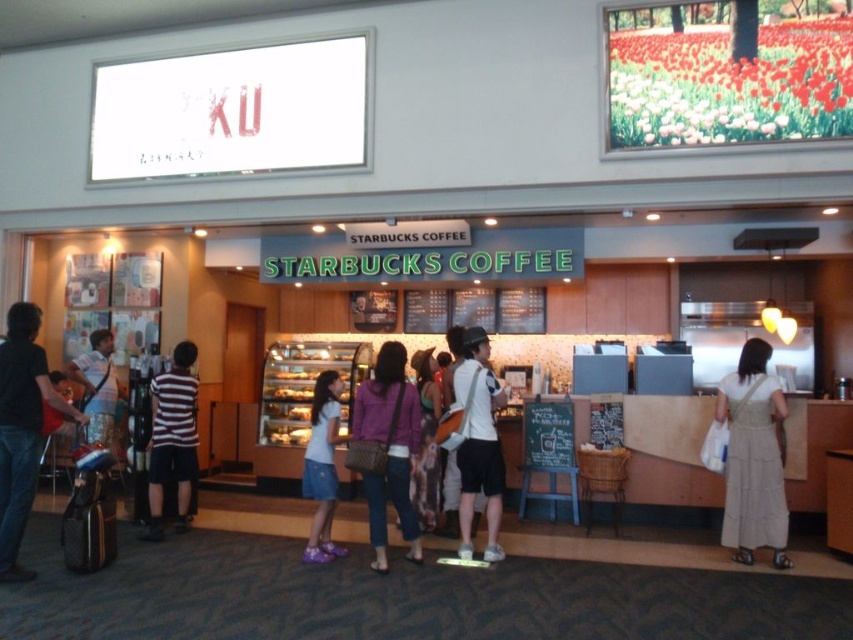
Find the location of `denim jacket at left`. denim jacket at left is located at coordinates (21, 429).

What do you see at coordinates (21, 429) in the screenshot?
I see `denim jacket at left` at bounding box center [21, 429].

The height and width of the screenshot is (640, 853). Identify the location of denim jacket at left. (21, 429).

Does denim jacket at left have a lesser height compared to white matte shirt at center?

No.

Between point (19, 328) and point (485, 392), which one is positioned behind?

Positioned behind is point (485, 392).

Locate an element on the screen. The width and height of the screenshot is (853, 640). denim jacket at left is located at coordinates (21, 429).

Between light beige dress at lower right and white denim skirt at center, which one appears on the right side from the viewer's perspective?

light beige dress at lower right

Is light beige dress at lower right above white denim skirt at center?

Indeed, light beige dress at lower right is positioned over white denim skirt at center.

Is point (747, 557) more distant than point (328, 396)?

No, (747, 557) is closer to viewer.

Identify the location of light beige dress at lower right. (753, 458).